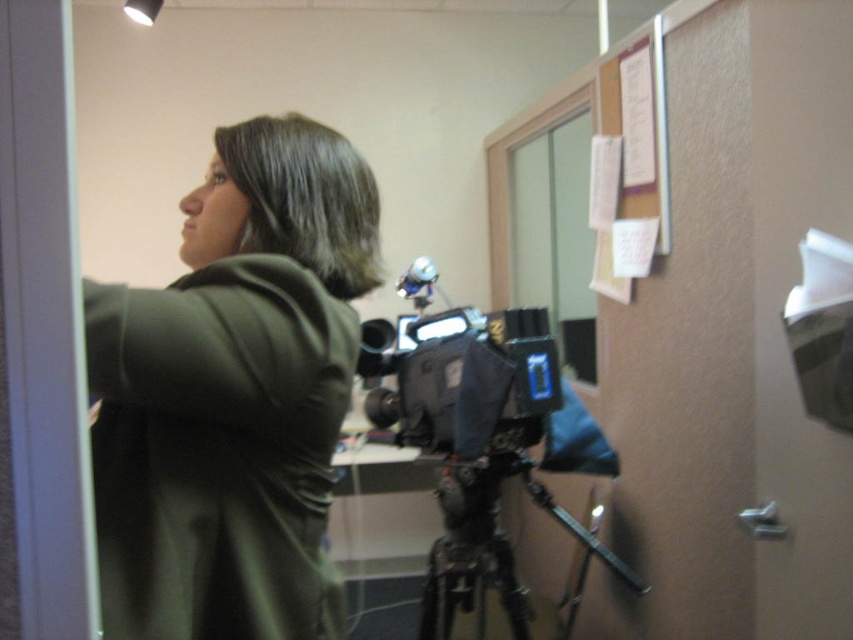
Does green matte jacket at upper left appear over black fabric camera at center?

Correct, green matte jacket at upper left is located above black fabric camera at center.

Which is in front, point (335, 156) or point (440, 381)?

Point (335, 156)

Locate an element on the screen. green matte jacket at upper left is located at coordinates (233, 394).

How distant is black matte video camera at center from black matte tripod at center?

black matte video camera at center is 6.75 centimeters away from black matte tripod at center.

Which of these two, black matte video camera at center or black matte tripod at center, stands shorter?

With less height is black matte tripod at center.

Which is in front, point (503, 408) or point (479, 524)?

Point (503, 408)

Image resolution: width=853 pixels, height=640 pixels. What are the coordinates of `black matte video camera at center` in the screenshot? It's located at (485, 449).

Is green matte jacket at upper left positioned behind black matte video camera at center?

No, it is in front of black matte video camera at center.

Which is behind, point (248, 120) or point (451, 529)?

The point (248, 120) is behind.

Where is `green matte jacket at upper left`? The image size is (853, 640). green matte jacket at upper left is located at coordinates (233, 394).